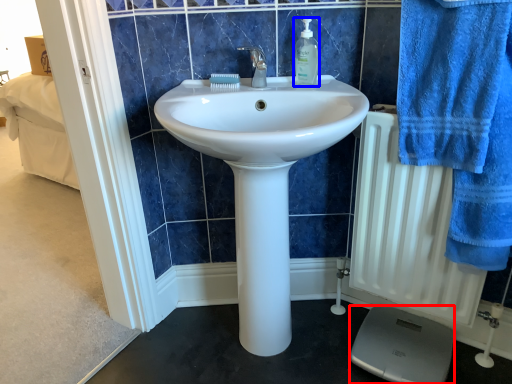
Question: Which of the following is the closest to the observer, scale (highlighted by a red box) or soap dispenser (highlighted by a blue box)?

Choices:
 (A) scale
 (B) soap dispenser

Answer: (B)